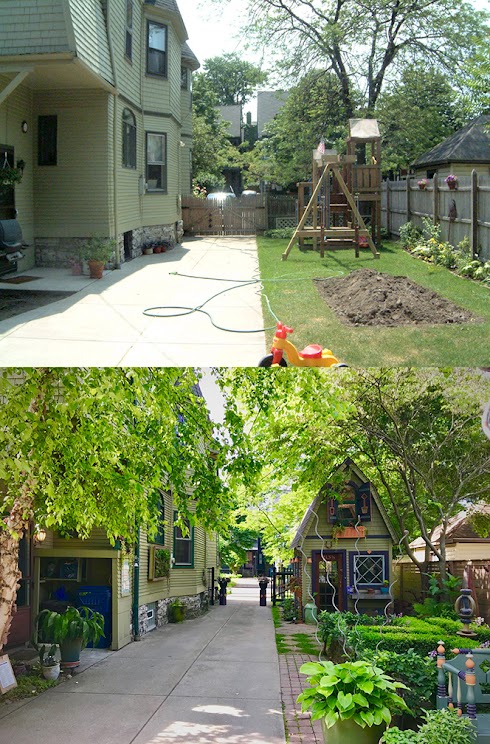
Where is `pot`? The height and width of the screenshot is (744, 490). pot is located at coordinates (351, 733).